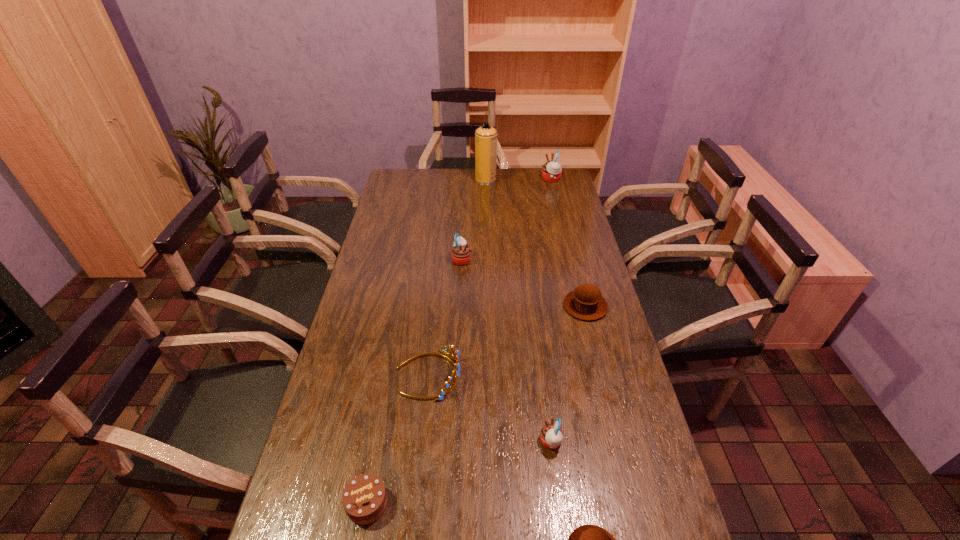
At what (x,y) coordinates should I click in order to perform the action: click on the third farthest muffin. Please return your answer as a coordinate pair (x, y). Image resolution: width=960 pixels, height=540 pixels. Looking at the image, I should click on [x=586, y=302].

The image size is (960, 540). What are the coordinates of `the farther brown muffin` in the screenshot? It's located at (586, 302).

Where is `the seventh farthest object`? the seventh farthest object is located at coordinates (364, 499).

This screenshot has height=540, width=960. I want to click on chocolate cake, so click(x=364, y=499).

The height and width of the screenshot is (540, 960). In order to click on blank space located on the front of the aerosol can in this screenshot , I will do `click(486, 195)`.

In order to click on free region located 0.160m on the front-facing side of the farthest pink muffin in this screenshot , I will do `click(509, 179)`.

The image size is (960, 540). I want to click on blank space located 0.090m on the front-facing side of the farthest pink muffin, so click(x=523, y=179).

Locate an element on the screen. The width and height of the screenshot is (960, 540). vacant position located on the front-facing side of the farthest pink muffin is located at coordinates (527, 179).

Where is `free space located 0.060m on the front-facing side of the third farthest object`? This screenshot has width=960, height=540. free space located 0.060m on the front-facing side of the third farthest object is located at coordinates (488, 259).

Where is `free space located 0.220m on the front-facing side of the gold tiara`? The width and height of the screenshot is (960, 540). free space located 0.220m on the front-facing side of the gold tiara is located at coordinates (536, 375).